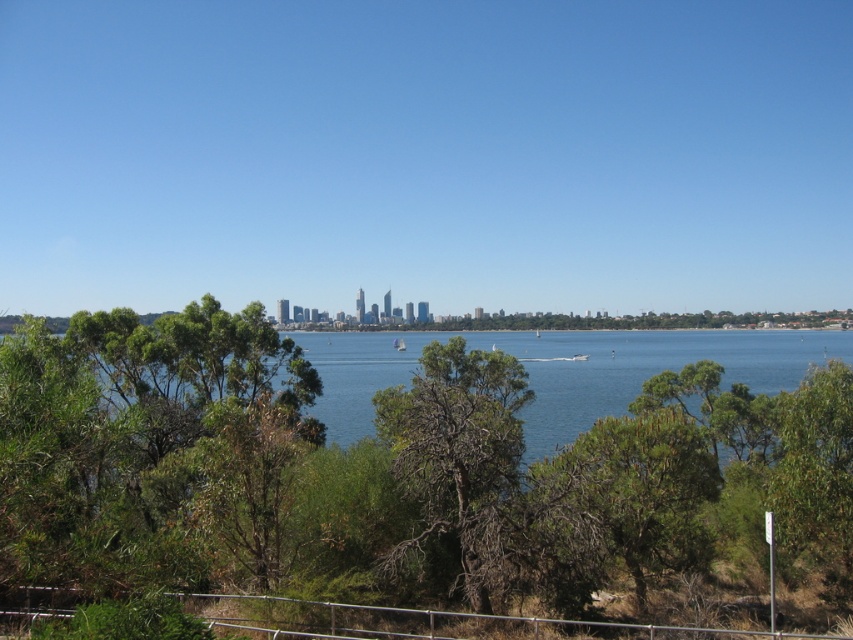
You are standing at the point with coordinates point (x=590, y=458) in the waterfront scene. You want to look towards the point with coordinates point (x=199, y=371). Will the lush green area block your view of that point?

Point (x=199, y=371) is behind point (x=590, y=458), so the lush green area might block your view of point (x=199, y=371) from your current position at point (x=590, y=458).

You are standing at the waterfront and want to take a photo of the green leafy tree at center. If your camera has a maximum focus range of 15 meters, will it be able to focus on the tree?

The green leafy tree at center is 14.25 meters away from the camera, which is within the maximum focus range of 15 meters. Therefore, the camera can focus on the tree.

You are standing at the waterfront and want to take a photo of the green leafy tree at center and the blue water at center. Based on their sizes in the scene, which one would appear larger in your photo?

The blue water at center appears larger than the green leafy tree at center in the photo because the description states that the green leafy tree at center is not as tall as the blue water at center.